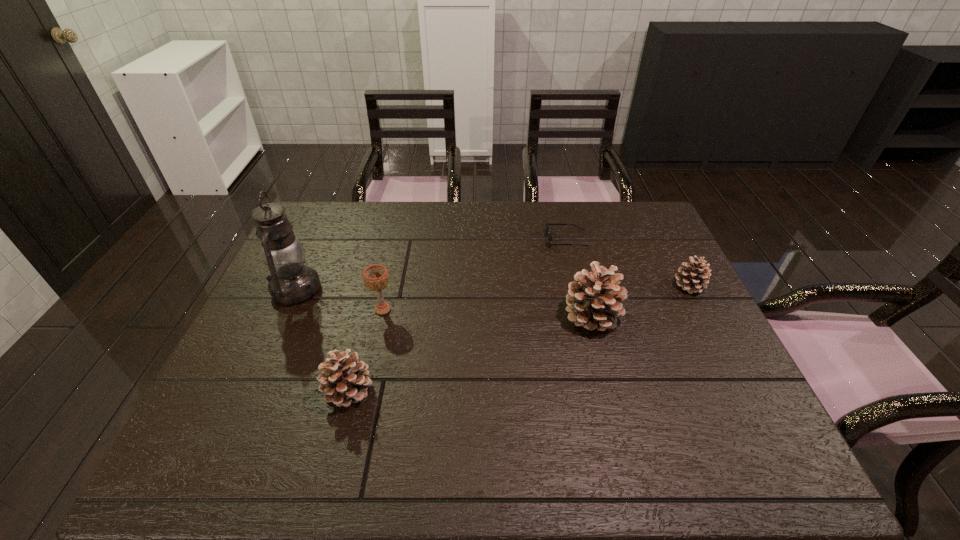
Identify the location of the tallest object. (291, 282).

Where is `free location located on the back of the nearest pinecone`? The image size is (960, 540). free location located on the back of the nearest pinecone is located at coordinates (375, 287).

Identify the location of free region located on the left of the fifth shortest object. (440, 316).

Where is `free space located 0.400m on the back of the rightmost object`? This screenshot has width=960, height=540. free space located 0.400m on the back of the rightmost object is located at coordinates (646, 202).

You are a GUI agent. You are given a task and a screenshot of the screen. Output one action in this format:
    pyautogui.click(x=<x>, y=<y>)
    Task: Click on the vacant space positioned 0.370m on the front-facing side of the sunglasses
    
    Given the screenshot: What is the action you would take?
    pyautogui.click(x=433, y=239)

You are a GUI agent. You are given a task and a screenshot of the screen. Output one action in this format:
    pyautogui.click(x=<x>, y=<y>)
    Task: Click on the vacant space situated on the front-facing side of the sunglasses
    This screenshot has width=960, height=540.
    Given the screenshot: What is the action you would take?
    pyautogui.click(x=497, y=239)

In order to click on vacant area located on the front-facing side of the sunglasses in this screenshot , I will do `click(510, 239)`.

Where is `vacant space located on the back of the chalice`? Image resolution: width=960 pixels, height=540 pixels. vacant space located on the back of the chalice is located at coordinates (402, 224).

Image resolution: width=960 pixels, height=540 pixels. Find the location of `free space located 0.190m on the back of the tallest object`. free space located 0.190m on the back of the tallest object is located at coordinates (322, 231).

You are a GUI agent. You are given a task and a screenshot of the screen. Output one action in this format:
    pyautogui.click(x=<x>, y=<y>)
    Task: Click on the object at the far edge
    Image resolution: width=960 pixels, height=540 pixels.
    Given the screenshot: What is the action you would take?
    pyautogui.click(x=547, y=224)